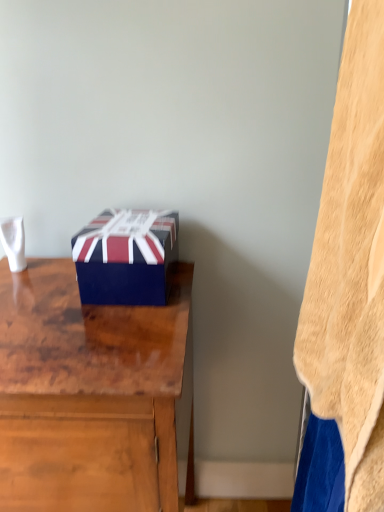
Identify the location of blank space situated above wooden desk at center (from a real-world perspective). (67, 314).